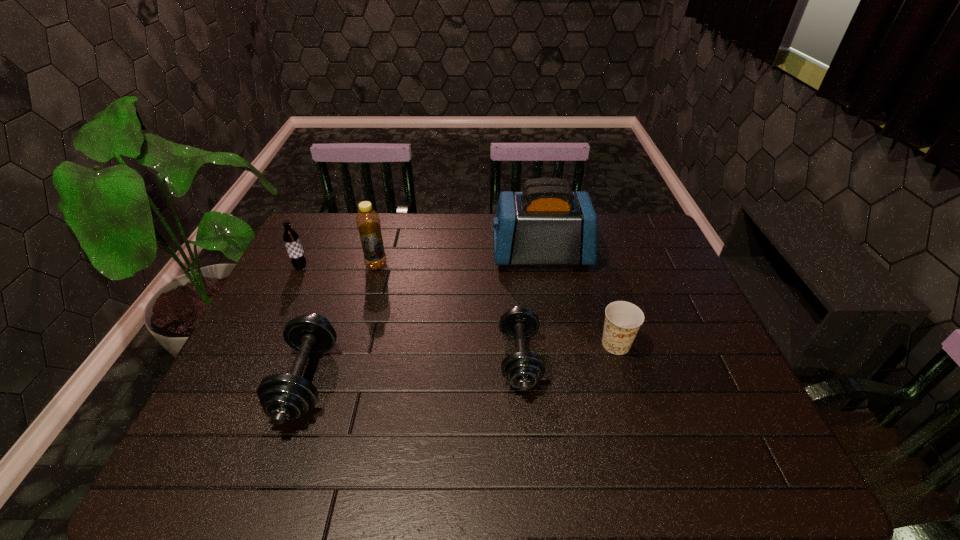
Where is `vacant space at the near edge of the desktop`? This screenshot has height=540, width=960. vacant space at the near edge of the desktop is located at coordinates (365, 415).

Identify the location of vacant position at the left edge of the desktop. The image size is (960, 540). (256, 331).

Where is `free space at the right edge`? free space at the right edge is located at coordinates (660, 347).

Image resolution: width=960 pixels, height=540 pixels. In order to click on free space between the toaster and the leftmost object in this screenshot , I will do 420,260.

Where is `vacant area between the taller dumbbell and the shorter dumbbell`? Image resolution: width=960 pixels, height=540 pixels. vacant area between the taller dumbbell and the shorter dumbbell is located at coordinates (413, 369).

At what (x,y) coordinates should I click in order to perform the action: click on empty location between the shorter dumbbell and the taller dumbbell. Please return your answer as a coordinate pair (x, y). Looking at the image, I should click on (413, 369).

In order to click on free space that is in between the root beer and the right dumbbell in this screenshot , I will do `click(410, 313)`.

Locate an element on the screen. This screenshot has height=540, width=960. free space between the toaster and the shorter dumbbell is located at coordinates (531, 307).

Identify the location of vacant area between the taller dumbbell and the toaster. (423, 318).

You are a GUI agent. You are given a task and a screenshot of the screen. Output one action in this format:
    pyautogui.click(x=<x>, y=<y>)
    Task: Click on the unoccupied area between the toaster and the Dixie cup
    
    Given the screenshot: What is the action you would take?
    pyautogui.click(x=579, y=300)